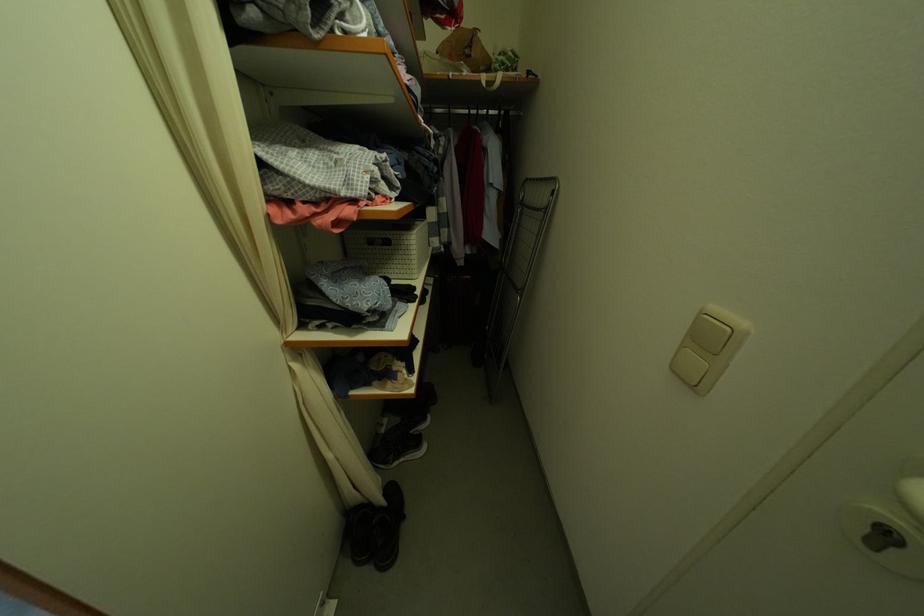
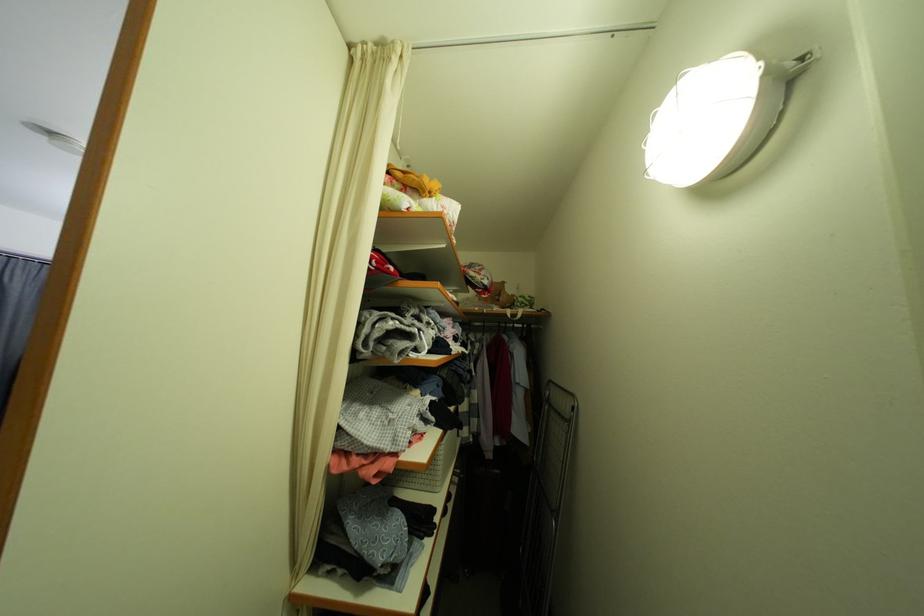
Question: How did the camera likely rotate?

Choices:
 (A) Left
 (B) Right
 (C) Up
 (D) Down

Answer: (C)